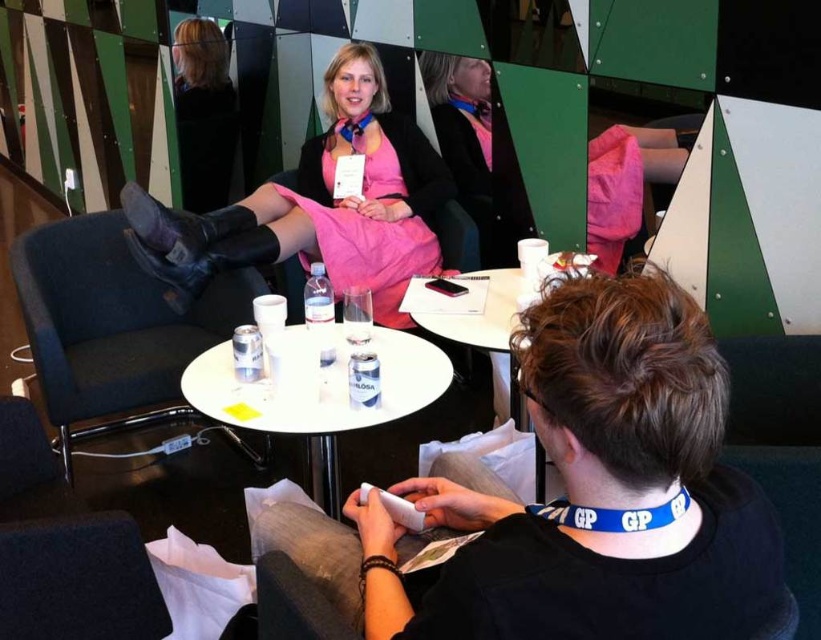
You are a delivery robot with a package that needs to be placed on the white plastic table at center. The package is 40 inches long. Can you fit the package on the table without moving the pink matte dress at center?

The distance between the pink matte dress at center and the white plastic table at center is 35.22 inches. Since the package is 40 inches long, it is longer than the available space, so the package cannot be placed on the table without moving the pink matte dress at center.

In the scene shown: You are a photographer setting up a shoot in this lounge. You want to ensure the pink matte dress at center is visible above the white plastic table at center in your photo. Based on their heights, is this possible?

The pink matte dress at center is much taller than the white plastic table at center, so yes, it will naturally be visible above the table in the photo.

Consider the image. You are standing in the lounge and want to place a black matte phone at lower center on the round white table. The table has a radius of 0.5 meters. Can you place the phone at point (579, 496) without it falling off the table?

The black matte phone at lower center is located at point (579, 496). Since the table has a radius of 0.5 meters, the maximum distance from the center to the edge is 0.5 meters. The distance from the center to point (579, 496) would be sqrt. However, without knowing the coordinates of the table center, we can assume that the phone is placed within the table area as it is described to be at lower center. Therefore, the phone can be placed safely without falling off.